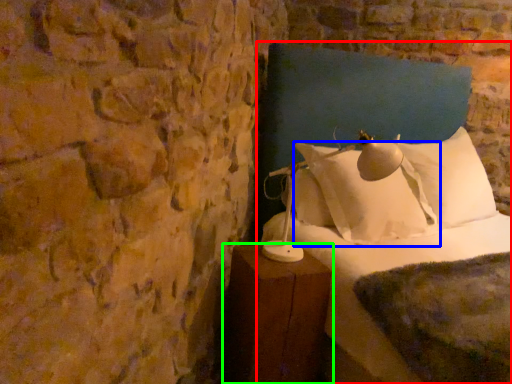
Question: Based on their relative distances, which object is farther from bed (highlighted by a red box)? Choose from pillow (highlighted by a blue box) and furniture (highlighted by a green box).

Choices:
 (A) pillow
 (B) furniture

Answer: (B)